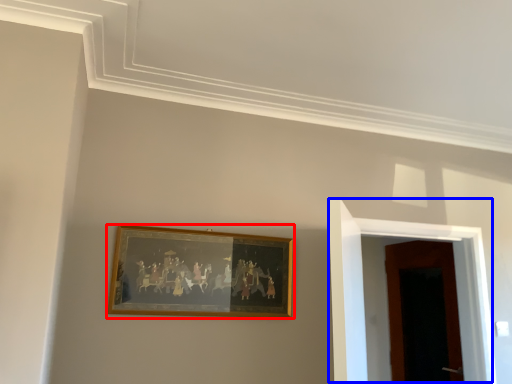
Question: Which object is closer to the camera taking this photo, picture frame (highlighted by a red box) or door (highlighted by a blue box)?

Choices:
 (A) picture frame
 (B) door

Answer: (A)